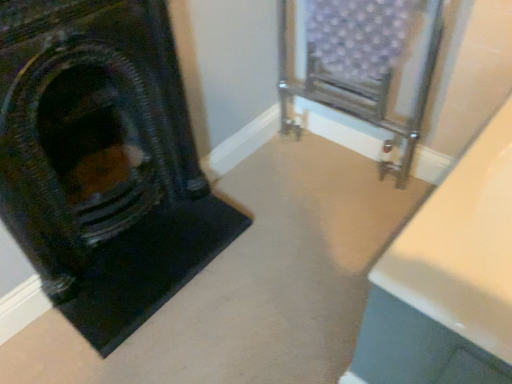
Locate an element on the screen. The image size is (512, 384). vacant region in front of matte black fireplace at left is located at coordinates (161, 339).